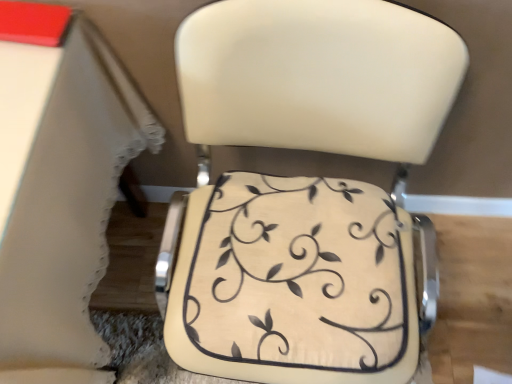
Measure the distance between white lace tablecloth at lower left and camera.

A distance of 21.47 inches exists between white lace tablecloth at lower left and camera.

You are a GUI agent. You are given a task and a screenshot of the screen. Output one action in this format:
    pyautogui.click(x=<x>, y=<y>)
    Task: Click on the matte cream cushion at center
    
    Given the screenshot: What is the action you would take?
    pyautogui.click(x=295, y=281)

This screenshot has width=512, height=384. Describe the element at coordinates (295, 281) in the screenshot. I see `matte cream cushion at center` at that location.

This screenshot has height=384, width=512. What do you see at coordinates (298, 275) in the screenshot?
I see `beige fabric cushion at center` at bounding box center [298, 275].

You are a GUI agent. You are given a task and a screenshot of the screen. Output one action in this format:
    pyautogui.click(x=<x>, y=<y>)
    Task: Click on the white lace tablecloth at lower left
    This screenshot has height=384, width=512.
    Given the screenshot: What is the action you would take?
    pyautogui.click(x=59, y=187)

Is matte cream cushion at center completely or partially outside of white lace tablecloth at lower left?

Yes, matte cream cushion at center is outside of white lace tablecloth at lower left.

Find the location of `table above the matte cream cushion at center (from the image's perspective)`. table above the matte cream cushion at center (from the image's perspective) is located at coordinates click(59, 187).

Can you confirm if matte cream cushion at center is taller than white lace tablecloth at lower left?

Indeed, matte cream cushion at center has a greater height compared to white lace tablecloth at lower left.

Looking at this image, between matte cream cushion at center and white lace tablecloth at lower left, which one has larger size?

white lace tablecloth at lower left is bigger.

Could you tell me if white lace tablecloth at lower left is facing beige fabric cushion at center?

No.

Does point (68, 56) come closer to viewer compared to point (307, 276)?

Yes, it is.

Does white lace tablecloth at lower left have a greater width compared to beige fabric cushion at center?

Correct, the width of white lace tablecloth at lower left exceeds that of beige fabric cushion at center.

Does white lace tablecloth at lower left come in front of beige fabric cushion at center?

Yes, it is in front of beige fabric cushion at center.

Locate an element on the screen. table located behind the matte cream cushion at center is located at coordinates (59, 187).

From the image's perspective, is white lace tablecloth at lower left located beneath matte cream cushion at center?

Incorrect, from the image's perspective, white lace tablecloth at lower left is higher than matte cream cushion at center.

Is white lace tablecloth at lower left aimed at matte cream cushion at center?

No.

Is white lace tablecloth at lower left at the left side of matte cream cushion at center?

Yes, white lace tablecloth at lower left is to the left of matte cream cushion at center.

Is beige fabric cushion at center placed right next to matte cream cushion at center?

Yes, beige fabric cushion at center is in contact with matte cream cushion at center.

Is the position of beige fabric cushion at center more distant than that of matte cream cushion at center?

That is True.

How distant is beige fabric cushion at center from matte cream cushion at center?

beige fabric cushion at center and matte cream cushion at center are 2.03 inches apart.

Is beige fabric cushion at center to the left or to the right of matte cream cushion at center in the image?

beige fabric cushion at center is positioned on matte cream cushion at center's left side.

From a real-world perspective, is beige fabric cushion at center located higher than white lace tablecloth at lower left?

Yes, from a real-world perspective, beige fabric cushion at center is above white lace tablecloth at lower left.

Are beige fabric cushion at center and white lace tablecloth at lower left located far from each other?

No, beige fabric cushion at center is not far from white lace tablecloth at lower left.

Between point (269, 258) and point (70, 371), which one is positioned behind?

Point (269, 258)

Looking at this image, how different are the orientations of beige fabric cushion at center and white lace tablecloth at lower left in degrees?

The angle between the facing direction of beige fabric cushion at center and the facing direction of white lace tablecloth at lower left is 2.66 degrees.

Which object is wider, matte cream cushion at center or beige fabric cushion at center?

Wider between the two is matte cream cushion at center.

Looking at the image, does matte cream cushion at center seem bigger or smaller compared to beige fabric cushion at center?

Clearly, matte cream cushion at center is larger in size than beige fabric cushion at center.

Considering the positions of objects matte cream cushion at center and beige fabric cushion at center in the image provided, who is more to the left, matte cream cushion at center or beige fabric cushion at center?

beige fabric cushion at center is more to the left.

Is beige fabric cushion at center at the back of matte cream cushion at center?

Yes, matte cream cushion at center is positioned with its back facing beige fabric cushion at center.

The height and width of the screenshot is (384, 512). What are the coordinates of `table behind the matte cream cushion at center` in the screenshot? It's located at (59, 187).

Locate an element on the screen. This screenshot has width=512, height=384. wedding cake on the right of white lace tablecloth at lower left is located at coordinates (298, 275).

From the image, which object appears to be nearer to matte cream cushion at center, white lace tablecloth at lower left or beige fabric cushion at center?

Among the two, beige fabric cushion at center is located nearer to matte cream cushion at center.

Looking at the image, which one is located closer to white lace tablecloth at lower left, beige fabric cushion at center or matte cream cushion at center?

matte cream cushion at center.

Estimate the real-world distances between objects in this image. Which object is closer to beige fabric cushion at center, white lace tablecloth at lower left or matte cream cushion at center?

matte cream cushion at center is closer to beige fabric cushion at center.

Estimate the real-world distances between objects in this image. Which object is closer to white lace tablecloth at lower left, matte cream cushion at center or beige fabric cushion at center?

matte cream cushion at center.

Considering their positions, is matte cream cushion at center positioned closer to beige fabric cushion at center than white lace tablecloth at lower left?

Based on the image, matte cream cushion at center appears to be nearer to beige fabric cushion at center.

When comparing their distances from matte cream cushion at center, does beige fabric cushion at center or white lace tablecloth at lower left seem closer?

beige fabric cushion at center.

At what (x,y) coordinates should I click in order to perform the action: click on wedding cake between white lace tablecloth at lower left and matte cream cushion at center in the horizontal direction. Please return your answer as a coordinate pair (x, y). The image size is (512, 384). Looking at the image, I should click on (298, 275).